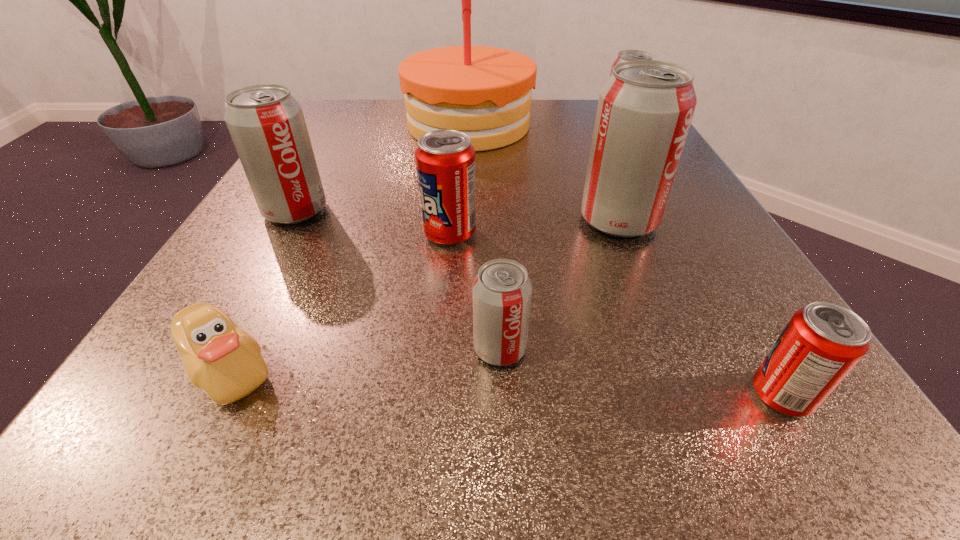
Image resolution: width=960 pixels, height=540 pixels. I want to click on object at the near right corner, so [x=822, y=342].

The height and width of the screenshot is (540, 960). What are the coordinates of `vacant space at the near edge of the desktop` in the screenshot? It's located at (620, 409).

Locate an element on the screen. Image resolution: width=960 pixels, height=540 pixels. vacant space at the left edge of the desktop is located at coordinates (205, 277).

Where is `vacant space at the right edge of the desktop`? vacant space at the right edge of the desktop is located at coordinates (659, 253).

Find the location of a particular element. The height and width of the screenshot is (540, 960). free region at the far left corner of the desktop is located at coordinates pyautogui.click(x=379, y=114).

The height and width of the screenshot is (540, 960). Identify the location of vacant area at the near right corner. (827, 404).

The height and width of the screenshot is (540, 960). In order to click on vacant area that lies between the smallest gray soda can and the tallest object in this screenshot , I will do `click(484, 237)`.

Image resolution: width=960 pixels, height=540 pixels. I want to click on vacant area that lies between the left red soda can and the smaller red soda can, so click(x=615, y=314).

You are a GUI agent. You are given a task and a screenshot of the screen. Output one action in this format:
    pyautogui.click(x=<x>, y=<y>)
    Task: Click on the free space between the second nearest soda can and the leftmost gray soda can
    This screenshot has height=540, width=960.
    Given the screenshot: What is the action you would take?
    pyautogui.click(x=397, y=280)

Identify the location of free space between the birthday cake and the beige duck. (348, 247).